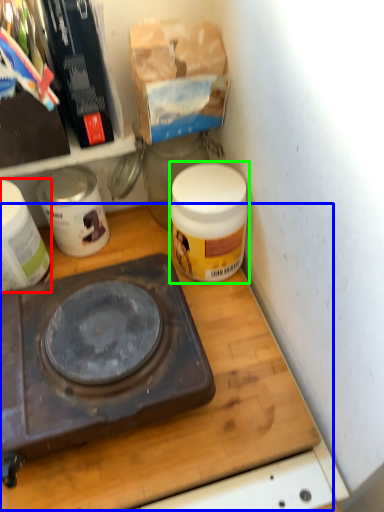
Question: Which object is the closest to the appliance (highlighted by a red box)? Choose among these: table (highlighted by a blue box) or product (highlighted by a green box).

Choices:
 (A) table
 (B) product

Answer: (A)